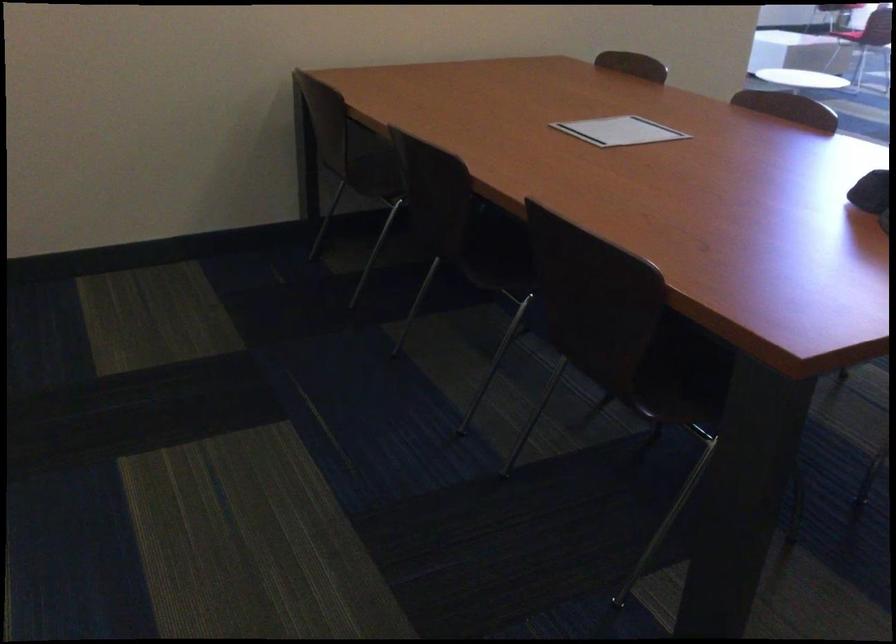
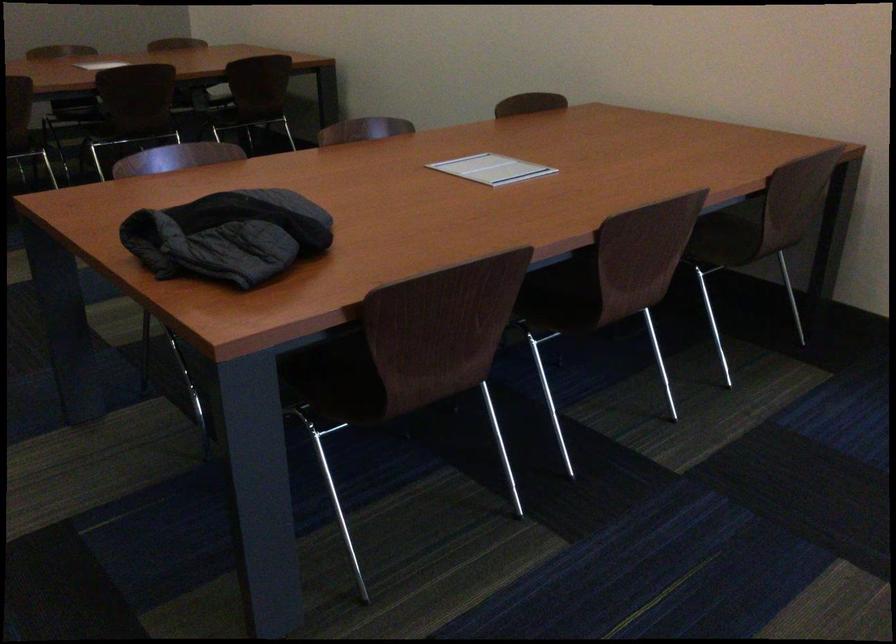
Question: I am providing you with two images of the same scene from different viewpoints. After the viewpoint changes to image2, which objects are now occluded?

Choices:
 (A) grey fabric curtain
 (B) chair sitting surface
 (C) brown chair sitting surface
 (D) dark quilted jacket

Answer: (C)